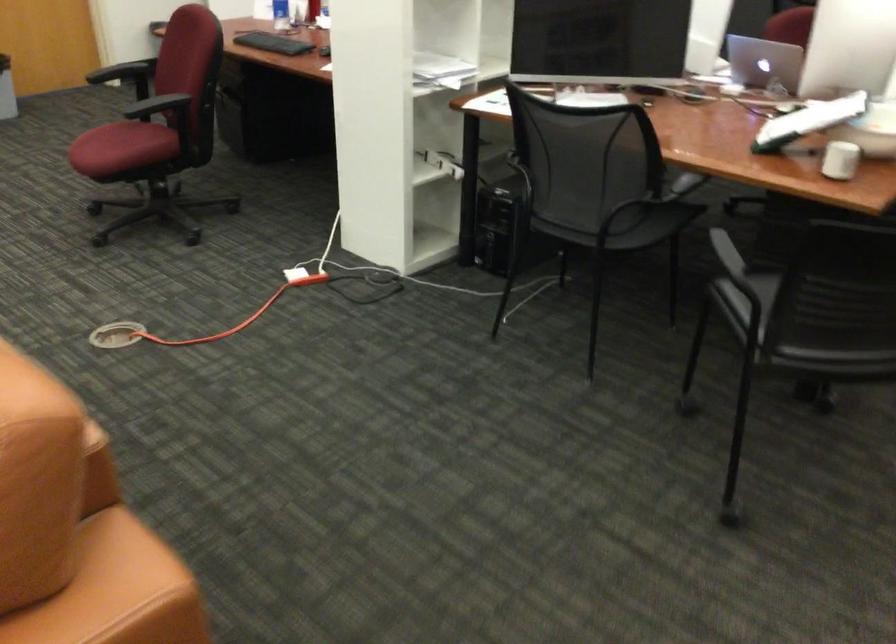
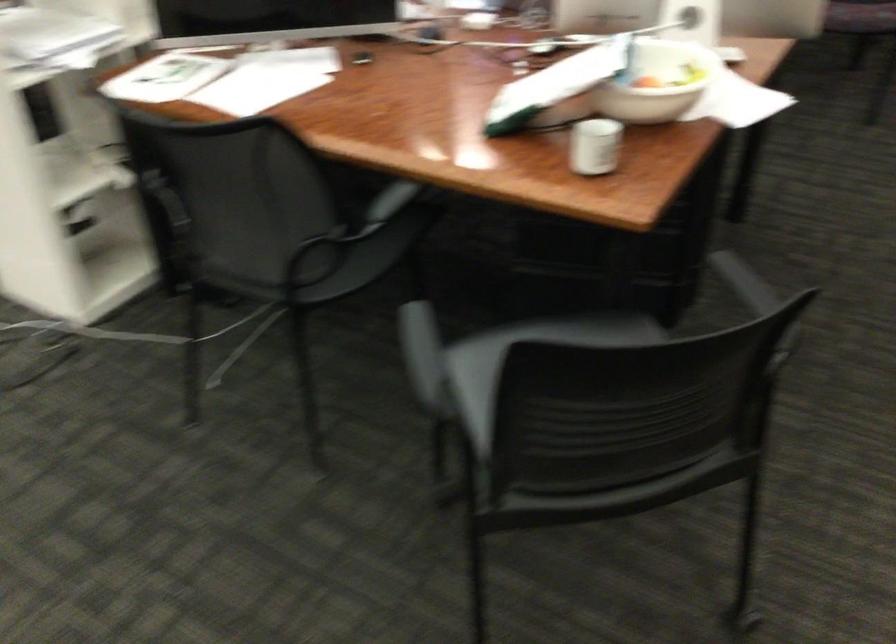
The point at (614, 218) is marked in the first image. Where is the corresponding point in the second image?

(314, 263)